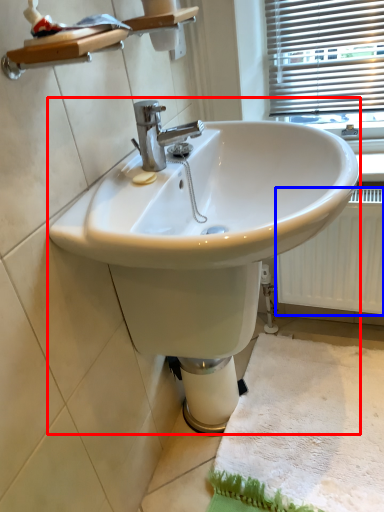
Question: Which object is closer to the camera taking this photo, sink (highlighted by a red box) or radiator (highlighted by a blue box)?

Choices:
 (A) sink
 (B) radiator

Answer: (A)